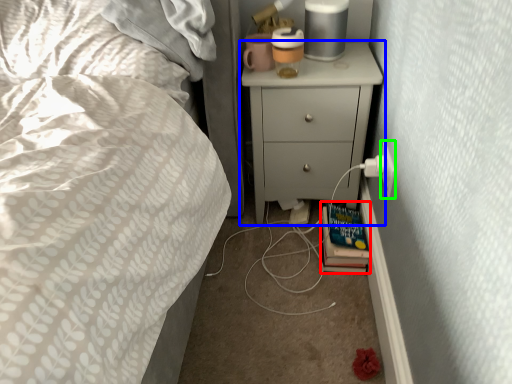
Question: Considering the real-world distances, which object is farthest from book (highlighted by a red box)? chest of drawers (highlighted by a blue box) or electric outlet (highlighted by a green box)?

Choices:
 (A) chest of drawers
 (B) electric outlet

Answer: (A)